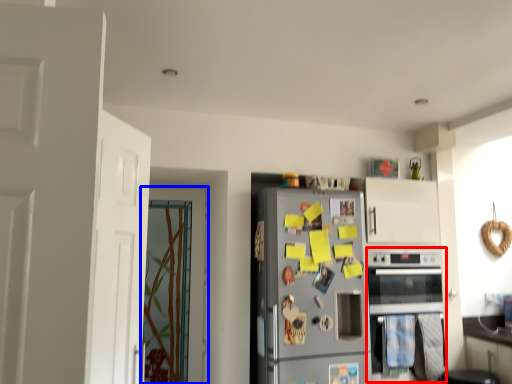
Question: Which point is closer to the camera, oven (highlighted by a red box) or door (highlighted by a blue box)?

Choices:
 (A) oven
 (B) door

Answer: (A)